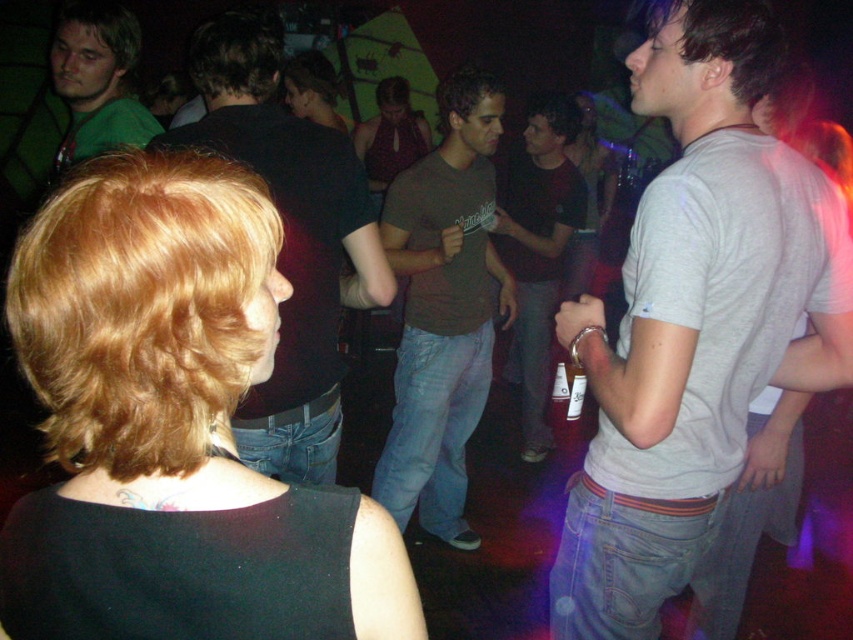
Question: Estimate the real-world distances between objects in this image. Which object is closer to the brown cotton shirt at center?

Choices:
 (A) green matte shirt at upper left
 (B) blonde hair at upper left
 (C) dark brown shirt at center

Answer: (A)

Question: Estimate the real-world distances between objects in this image. Which object is farther from the smooth black dress at center?

Choices:
 (A) green matte shirt at upper left
 (B) dark brown shirt at center
 (C) matte brown t-shirt at center

Answer: (B)

Question: Is matte brown t-shirt at center below green matte shirt at upper left?

Choices:
 (A) yes
 (B) no

Answer: (A)

Question: Which object is the closest to the smooth black dress at center?

Choices:
 (A) matte red halter top at center
 (B) matte black shirt at center

Answer: (A)

Question: Is gray cotton t-shirt at center to the right of matte red halter top at center from the viewer's perspective?

Choices:
 (A) no
 (B) yes

Answer: (B)

Question: Observing the image, what is the correct spatial positioning of gray cotton t-shirt at center in reference to brown cotton shirt at center?

Choices:
 (A) above
 (B) below

Answer: (B)